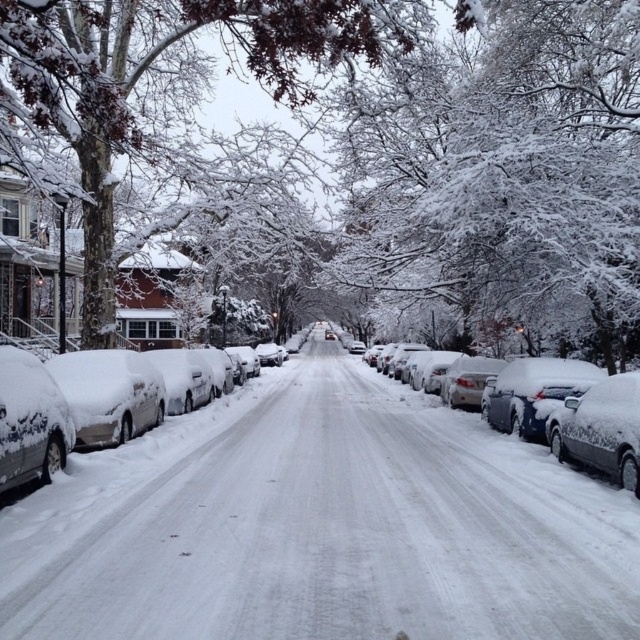
You are a delivery robot navigating a snowy street. You need to move from your current position to a delivery point. There are two points marked on the map as point 1 at coordinates point (20,22) and point 2 at coordinates point (67,432). According to the scene description, which point is closer to your starting position?

Point 1 at coordinates point (20,22) is closer to your starting position because it is in front of point 2 at coordinates point (67,432).